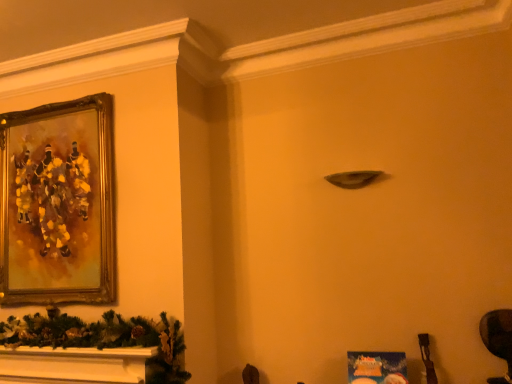
Question: Is gold-framed painting at upper left not near dark brown leather swivel chair at lower right?

Choices:
 (A) yes
 (B) no

Answer: (A)

Question: From a real-world perspective, is gold-framed painting at upper left on dark brown leather swivel chair at lower right?

Choices:
 (A) no
 (B) yes

Answer: (B)

Question: Could you tell me if gold-framed painting at upper left is turned towards dark brown leather swivel chair at lower right?

Choices:
 (A) no
 (B) yes

Answer: (A)

Question: Is dark brown leather swivel chair at lower right completely or partially inside gold-framed painting at upper left?

Choices:
 (A) no
 (B) yes

Answer: (A)

Question: From a real-world perspective, is gold-framed painting at upper left positioned under dark brown leather swivel chair at lower right based on gravity?

Choices:
 (A) yes
 (B) no

Answer: (B)

Question: Can you see gold-framed painting at upper left touching dark brown leather swivel chair at lower right?

Choices:
 (A) no
 (B) yes

Answer: (A)

Question: Is dark brown leather swivel chair at lower right outside of gold-framed painting at upper left?

Choices:
 (A) yes
 (B) no

Answer: (A)

Question: Is dark brown leather swivel chair at lower right bigger than gold-framed painting at upper left?

Choices:
 (A) no
 (B) yes

Answer: (A)

Question: Considering the relative sizes of dark brown leather swivel chair at lower right and gold-framed painting at upper left in the image provided, is dark brown leather swivel chair at lower right taller than gold-framed painting at upper left?

Choices:
 (A) yes
 (B) no

Answer: (B)

Question: From a real-world perspective, is dark brown leather swivel chair at lower right on gold-framed painting at upper left?

Choices:
 (A) no
 (B) yes

Answer: (A)

Question: Is dark brown leather swivel chair at lower right beside gold-framed painting at upper left?

Choices:
 (A) no
 (B) yes

Answer: (A)

Question: Is gold-framed painting at upper left a part of dark brown leather swivel chair at lower right?

Choices:
 (A) yes
 (B) no

Answer: (B)

Question: From a real-world perspective, is dark brown leather swivel chair at lower right positioned above or below gold-framed painting at upper left?

Choices:
 (A) below
 (B) above

Answer: (A)